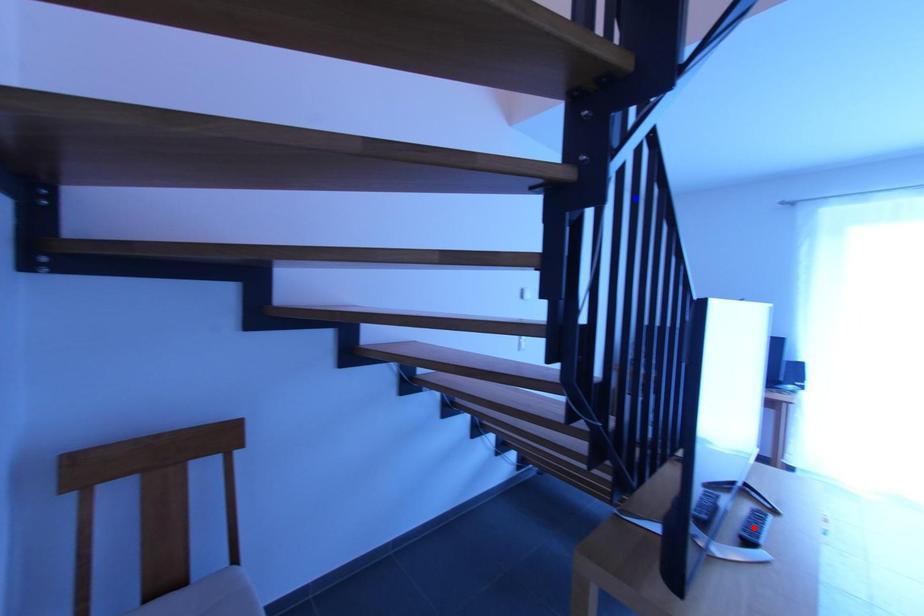
Question: In the image, two points are highlighted. Which point is nearer to the camera? Reply with the corresponding letter.

Choices:
 (A) blue point
 (B) red point

Answer: (A)